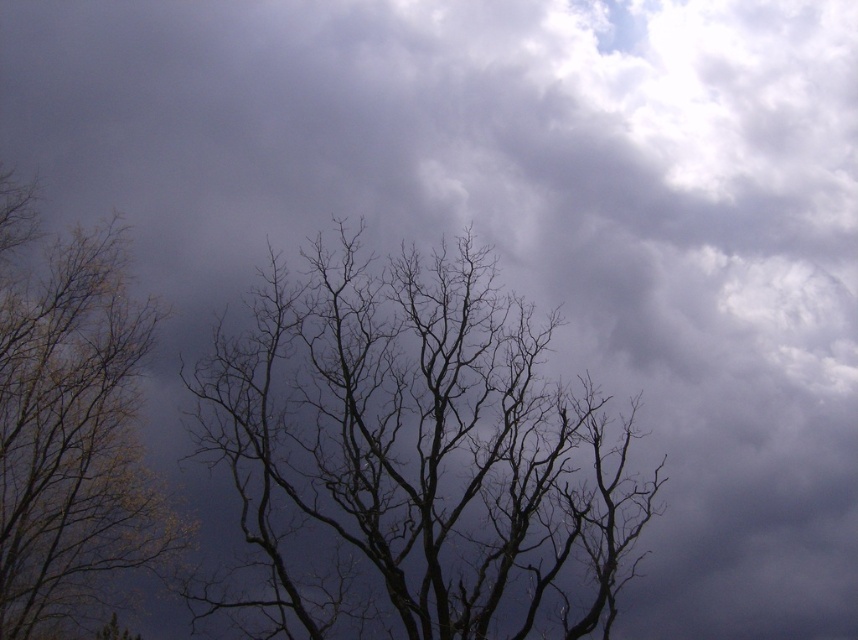
Question: In this image, where is black matte tree at center located relative to yellow-green leaves at left?

Choices:
 (A) below
 (B) above

Answer: (A)

Question: Observing the image, what is the correct spatial positioning of black matte tree at center in reference to yellow-green leaves at left?

Choices:
 (A) right
 (B) left

Answer: (A)

Question: Which point is farther to the camera?

Choices:
 (A) (21, 438)
 (B) (289, 321)

Answer: (A)

Question: Among these objects, which one is farthest from the camera?

Choices:
 (A) black matte tree at center
 (B) yellow-green leaves at left

Answer: (B)

Question: Does black matte tree at center come in front of yellow-green leaves at left?

Choices:
 (A) no
 (B) yes

Answer: (B)